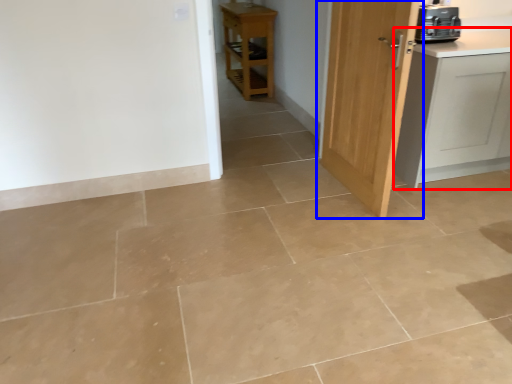
Question: Which object appears closest to the camera in this image, cabinetry (highlighted by a red box) or door (highlighted by a blue box)?

Choices:
 (A) cabinetry
 (B) door

Answer: (B)